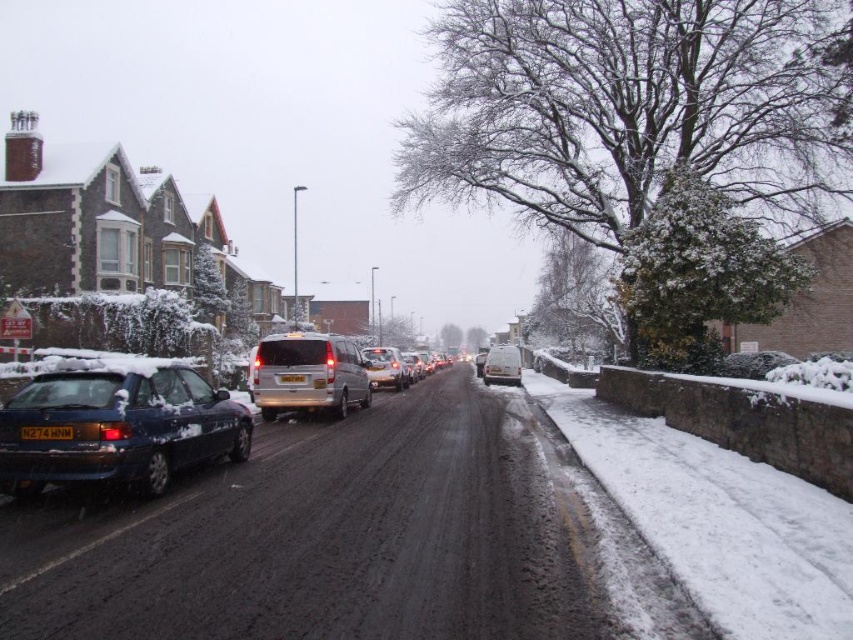
Does point (369, 349) come farther from viewer compared to point (51, 440)?

Yes.

Who is higher up, shiny gold car at center or black plastic license plate at center?

Positioned higher is black plastic license plate at center.

This screenshot has height=640, width=853. In order to click on shiny gold car at center in this screenshot , I will do tap(386, 368).

Who is lower down, silver metallic van at center or shiny gold car at center?

silver metallic van at center

Describe the element at coordinates (308, 374) in the screenshot. I see `silver metallic van at center` at that location.

Find the location of a particular element. Image resolution: width=853 pixels, height=640 pixels. silver metallic van at center is located at coordinates (308, 374).

Which is above, shiny gold car at center or white plastic license plate at center?

white plastic license plate at center

Between point (403, 378) and point (294, 381), which one is positioned in front?

Point (294, 381) is in front.

Is point (373, 385) closer to camera compared to point (296, 372)?

No, (373, 385) is further to viewer.

I want to click on shiny gold car at center, so click(386, 368).